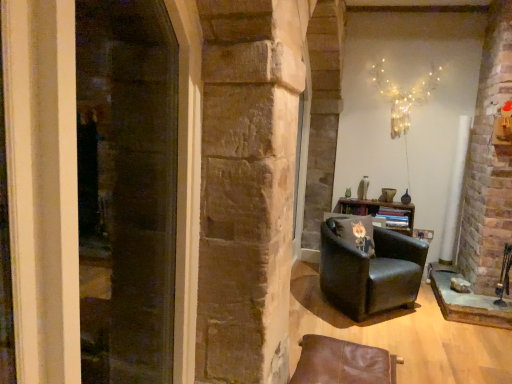
Question: Is black fabric pillow at center-right looking in the opposite direction of brown leather chair at lower right, which is counted as the 1th chair, starting from the front?

Choices:
 (A) no
 (B) yes

Answer: (A)

Question: From the image's perspective, would you say black fabric pillow at center-right is positioned over brown leather chair at lower right, which is counted as the 1th chair, starting from the front?

Choices:
 (A) yes
 (B) no

Answer: (A)

Question: Is black fabric pillow at center-right positioned in front of brown leather chair at lower right, which is the 2th chair from back to front?

Choices:
 (A) yes
 (B) no

Answer: (B)

Question: Is black fabric pillow at center-right further to camera compared to brown leather chair at lower right, which is the 2th chair from back to front?

Choices:
 (A) no
 (B) yes

Answer: (B)

Question: Can you confirm if black fabric pillow at center-right is taller than brown leather chair at lower right, which is counted as the 1th chair, starting from the front?

Choices:
 (A) no
 (B) yes

Answer: (A)

Question: Is the surface of black fabric pillow at center-right in direct contact with brown leather chair at lower right, which is counted as the 1th chair, starting from the front?

Choices:
 (A) yes
 (B) no

Answer: (B)

Question: From the image's perspective, would you say transparent glass screen door at left is shown under black fabric pillow at center-right?

Choices:
 (A) yes
 (B) no

Answer: (B)

Question: From a real-world perspective, is transparent glass screen door at left over black fabric pillow at center-right?

Choices:
 (A) yes
 (B) no

Answer: (A)

Question: Is transparent glass screen door at left turned away from black fabric pillow at center-right?

Choices:
 (A) yes
 (B) no

Answer: (B)

Question: Is transparent glass screen door at left surrounding black fabric pillow at center-right?

Choices:
 (A) yes
 (B) no

Answer: (B)

Question: From the image's perspective, is transparent glass screen door at left located above black fabric pillow at center-right?

Choices:
 (A) no
 (B) yes

Answer: (B)

Question: Does transparent glass screen door at left have a greater height compared to black fabric pillow at center-right?

Choices:
 (A) yes
 (B) no

Answer: (A)

Question: Is black leather armchair at center-right, which ranks as the 2th chair in front-to-back order, behind illuminated wire at upper center?

Choices:
 (A) no
 (B) yes

Answer: (A)